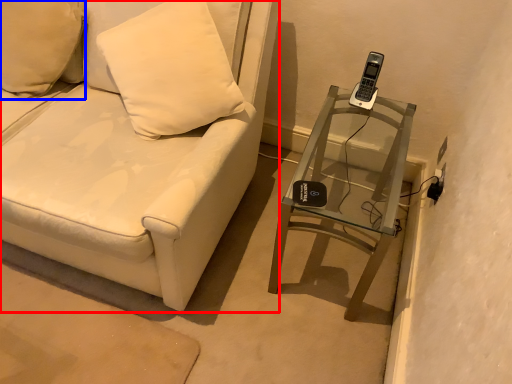
Question: Which point is further to the camera, furniture (highlighted by a red box) or pillow (highlighted by a blue box)?

Choices:
 (A) furniture
 (B) pillow

Answer: (B)